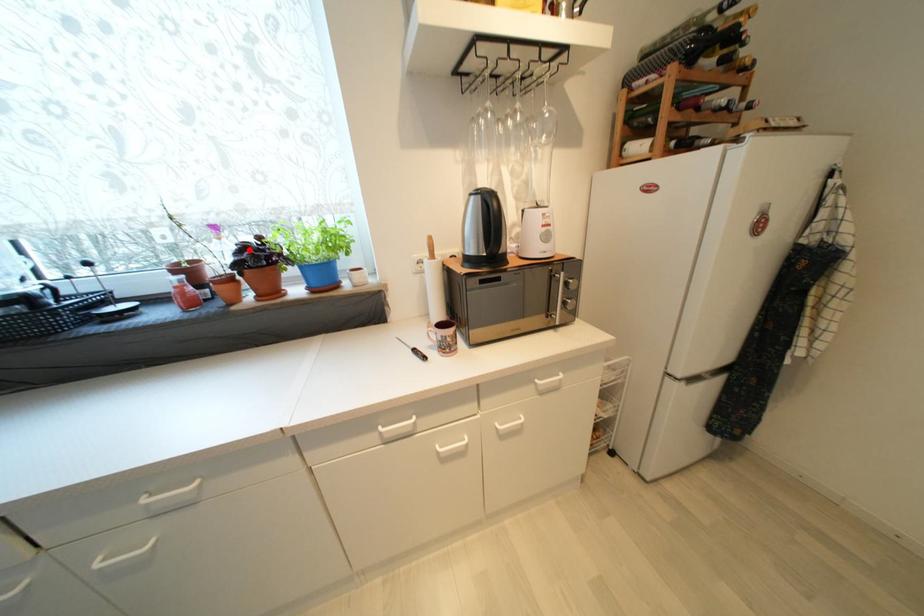
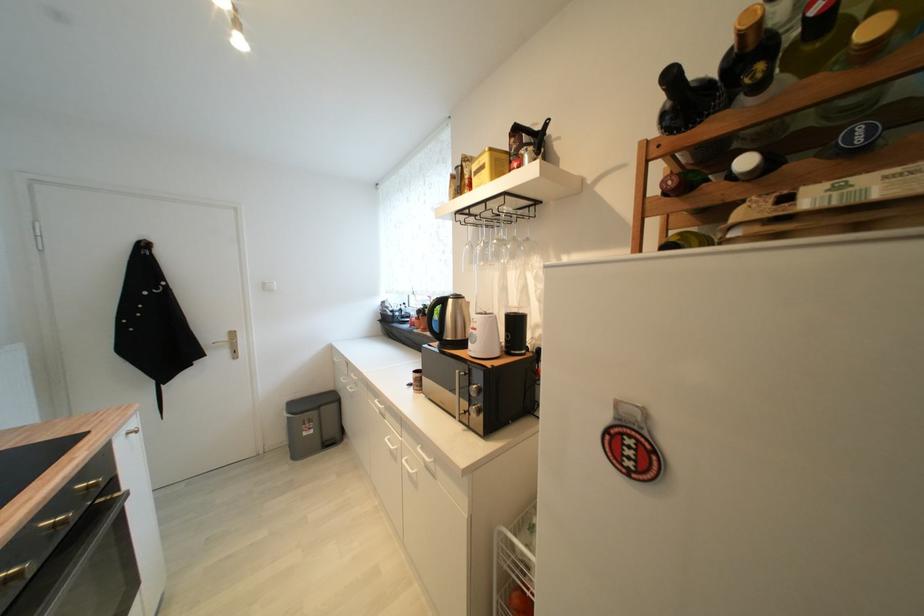
The point at the highlighted location is marked in the first image. Where is the corresponding point in the second image?

(431, 309)